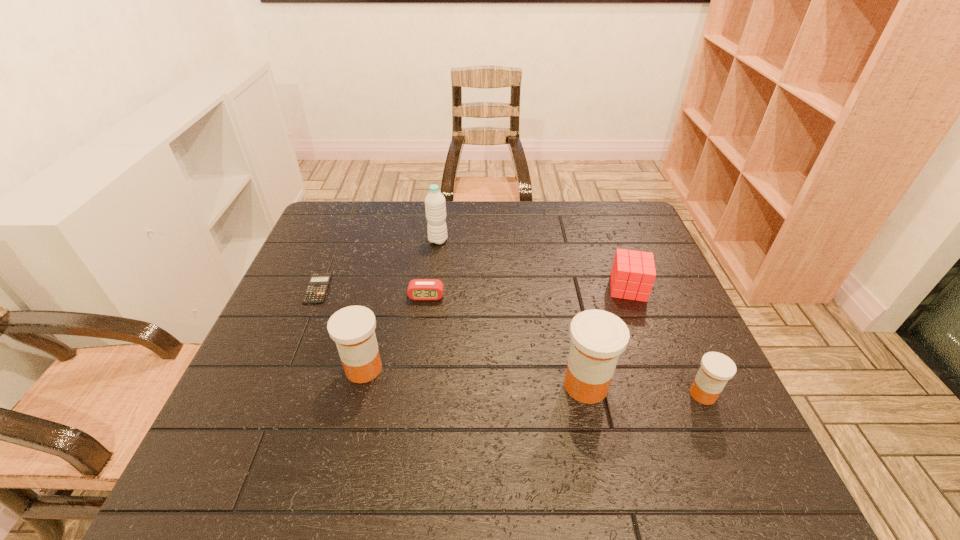
You are a GUI agent. You are given a task and a screenshot of the screen. Output one action in this format:
    pyautogui.click(x=<x>, y=<y>)
    Task: Click on the fifth shortest object
    This screenshot has width=960, height=540.
    Given the screenshot: What is the action you would take?
    pyautogui.click(x=352, y=328)

Locate an element on the screen. the leftmost medicine is located at coordinates (352, 328).

Locate an element on the screen. the second medicine from left to right is located at coordinates (598, 337).

The image size is (960, 540). In order to click on the rightmost medicine in this screenshot , I will do click(x=716, y=369).

Identify the location of water bottle. (435, 206).

Find the location of a particular element. Image resolution: width=960 pixels, height=540 pixels. cube is located at coordinates (633, 273).

Locate an element on the screen. The width and height of the screenshot is (960, 540). the shortest object is located at coordinates (316, 289).

You are a GUI agent. You are given a task and a screenshot of the screen. Output one action in this format:
    pyautogui.click(x=<x>, y=<y>)
    Task: Click on the calculator
    
    Given the screenshot: What is the action you would take?
    pyautogui.click(x=316, y=289)

Image resolution: width=960 pixels, height=540 pixels. In order to click on the second shortest object in this screenshot , I will do `click(418, 289)`.

I want to click on vacant space situated on the label of the leftmost medicine, so click(353, 411).